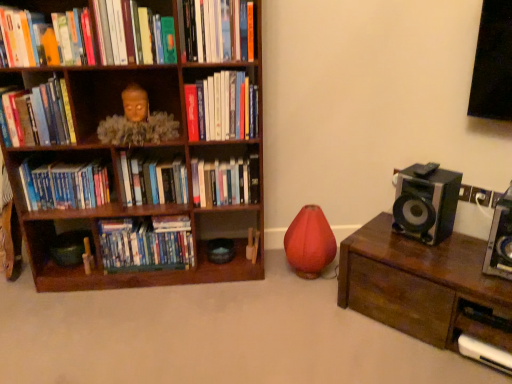
Question: From a real-world perspective, is wooden statue at upper left above or below hardcover book at left, the 5th book when ordered from top to bottom?

Choices:
 (A) above
 (B) below

Answer: (B)

Question: Is wooden statue at upper left wider or thinner than hardcover book at left, which ranks as the fifth book in bottom-to-top order?

Choices:
 (A) thin
 (B) wide

Answer: (B)

Question: Estimate the real-world distances between objects in this image. Which object is closer to the matte green book at upper center, the eighth book from the bottom?

Choices:
 (A) wooden statue at upper left
 (B) metallic silver speaker at right, the second speaker positioned from the left
 (C) matte orange book at upper left, which is the seventh book from bottom to top
 (D) hardcover books at center, the fourth book ordered from the bottom
 (E) brown wooden bookcase at left

Answer: (C)

Question: Estimate the real-world distances between objects in this image. Which object is closer to the matte plastic dvds at lower left, which is the 9th book in top-to-bottom order?

Choices:
 (A) hardcover book at center, the 4th book viewed from the top
 (B) hardcover books at left, the 3th book in the bottom-to-top sequence
 (C) brown wooden bookcase at left
 (D) hardcover books at center, arranged as the second book when ordered from the bottom
 (E) wooden chest at right

Answer: (C)